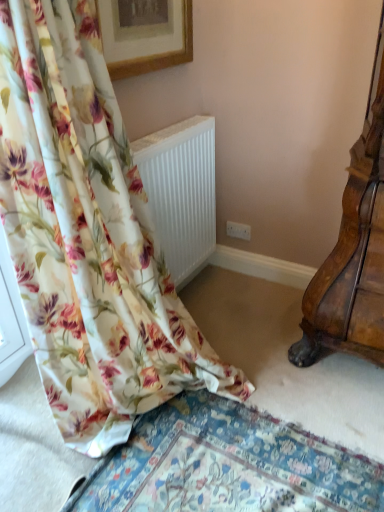
Locate an element on the screen. wooden picture frame at upper center is located at coordinates (145, 35).

Identify the location of wooden picture frame at upper center. (145, 35).

Find the location of `curtain to the left of white ribbed radiator at lower left`. curtain to the left of white ribbed radiator at lower left is located at coordinates (88, 234).

Which object is positioned more to the left, white ribbed radiator at lower left or floral fabric curtain at left?

Positioned to the left is floral fabric curtain at left.

Is white ribbed radiator at lower left directly adjacent to floral fabric curtain at left?

white ribbed radiator at lower left and floral fabric curtain at left are clearly separated.

Does white ribbed radiator at lower left have a smaller size compared to floral fabric curtain at left?

Yes, white ribbed radiator at lower left is smaller than floral fabric curtain at left.

Based on the photo, how many degrees apart are the facing directions of wooden picture frame at upper center and floral fabric curtain at left?

The angular difference between wooden picture frame at upper center and floral fabric curtain at left is 1.44 degrees.

Considering the sizes of objects wooden picture frame at upper center and floral fabric curtain at left in the image provided, who is wider, wooden picture frame at upper center or floral fabric curtain at left?

floral fabric curtain at left.

Is wooden picture frame at upper center bigger or smaller than floral fabric curtain at left?

wooden picture frame at upper center is smaller than floral fabric curtain at left.

Based on the photo, is wooden picture frame at upper center with floral fabric curtain at left?

No, wooden picture frame at upper center is not touching floral fabric curtain at left.

Does point (95, 32) come farther from viewer compared to point (210, 189)?

No, (95, 32) is in front of (210, 189).

Is floral fabric curtain at left facing towards white ribbed radiator at lower left?

No, floral fabric curtain at left is not oriented towards white ribbed radiator at lower left.

Is floral fabric curtain at left to the left or to the right of white ribbed radiator at lower left in the image?

Clearly, floral fabric curtain at left is on the left of white ribbed radiator at lower left in the image.

From a real-world perspective, does floral fabric curtain at left sit lower than white ribbed radiator at lower left?

No, from a real-world perspective, floral fabric curtain at left is not under white ribbed radiator at lower left.

Is point (145, 187) in front of point (106, 44)?

No, (145, 187) is further to viewer.

Is white ribbed radiator at lower left with wooden picture frame at upper center?

white ribbed radiator at lower left is not next to wooden picture frame at upper center, and they're not touching.

Which object is wider, white ribbed radiator at lower left or wooden picture frame at upper center?

white ribbed radiator at lower left is wider.

Considering the sizes of white ribbed radiator at lower left and wooden picture frame at upper center in the image, is white ribbed radiator at lower left taller or shorter than wooden picture frame at upper center?

Clearly, white ribbed radiator at lower left is taller compared to wooden picture frame at upper center.

Is wooden picture frame at upper center in front of or behind white ribbed radiator at lower left in the image?

Clearly, wooden picture frame at upper center is in front of white ribbed radiator at lower left.

Does wooden picture frame at upper center appear on the left side of white ribbed radiator at lower left?

Yes, wooden picture frame at upper center is to the left of white ribbed radiator at lower left.

Could you tell me if wooden picture frame at upper center is facing white ribbed radiator at lower left?

No.

From the image's perspective, which one is positioned lower, wooden picture frame at upper center or white ribbed radiator at lower left?

white ribbed radiator at lower left appears lower in the image.

Is floral fabric curtain at left oriented towards wooden picture frame at upper center?

No, floral fabric curtain at left is not aimed at wooden picture frame at upper center.

Is wooden picture frame at upper center completely or partially inside floral fabric curtain at left?

No, floral fabric curtain at left does not contain wooden picture frame at upper center.

Which of these two, floral fabric curtain at left or wooden picture frame at upper center, stands shorter?

Standing shorter between the two is wooden picture frame at upper center.

Find the location of a particular element. This screenshot has height=512, width=384. picture frame on the right of floral fabric curtain at left is located at coordinates (145, 35).

Where is `radiator that appears on the right of floral fabric curtain at left`? Image resolution: width=384 pixels, height=512 pixels. radiator that appears on the right of floral fabric curtain at left is located at coordinates (181, 192).

What are the coordinates of `curtain located on the left of wooden picture frame at upper center` in the screenshot? It's located at (88, 234).

When comparing their distances from floral fabric curtain at left, does wooden picture frame at upper center or white ribbed radiator at lower left seem closer?

The object closer to floral fabric curtain at left is white ribbed radiator at lower left.

Based on their spatial positions, is floral fabric curtain at left or white ribbed radiator at lower left further from wooden picture frame at upper center?

floral fabric curtain at left lies further to wooden picture frame at upper center than the other object.

Considering their positions, is floral fabric curtain at left positioned closer to white ribbed radiator at lower left than wooden picture frame at upper center?

Among the two, wooden picture frame at upper center is located nearer to white ribbed radiator at lower left.

In the scene shown: Based on their spatial positions, is white ribbed radiator at lower left or wooden picture frame at upper center further from floral fabric curtain at left?

Based on the image, wooden picture frame at upper center appears to be further to floral fabric curtain at left.

Estimate the real-world distances between objects in this image. Which object is closer to wooden picture frame at upper center, white ribbed radiator at lower left or floral fabric curtain at left?

white ribbed radiator at lower left is positioned closer to the anchor wooden picture frame at upper center.

Estimate the real-world distances between objects in this image. Which object is further from white ribbed radiator at lower left, wooden picture frame at upper center or floral fabric curtain at left?

floral fabric curtain at left is positioned further to the anchor white ribbed radiator at lower left.

Locate an element on the screen. The height and width of the screenshot is (512, 384). picture frame located between floral fabric curtain at left and white ribbed radiator at lower left in the depth direction is located at coordinates point(145,35).